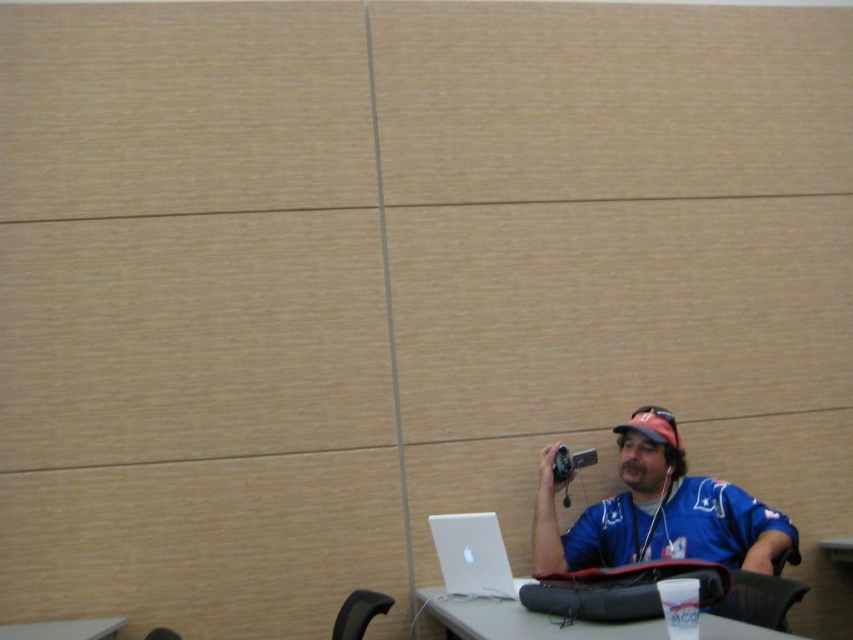
You are organizing a photo shoot in the conference room. You need to place the blue jersey at lower right and the silver metallic video camera at upper right on a table. Based on their sizes, which object should you place closer to the edge of the table to prevent them from overlapping?

The blue jersey at lower right might be wider than the silver metallic video camera at upper right, so placing the camera closer to the edge would prevent overlapping.

You are organizing a photo shoot and need to ensure that the blue jersey at lower right and the silver metallic video camera at upper right are both visible in the frame. Given their sizes, which object might require more space in the composition?

The blue jersey at lower right is bigger than the silver metallic video camera at upper right, so it might require more space in the composition.

From the picture: You are standing at the point labeled point [38,625] in the image. You want to walk to the point labeled point [677,497]. Which direction should you move relative to the man sitting at the desk?

You should move behind the man sitting at the desk because point [677,497] is behind point [38,625].